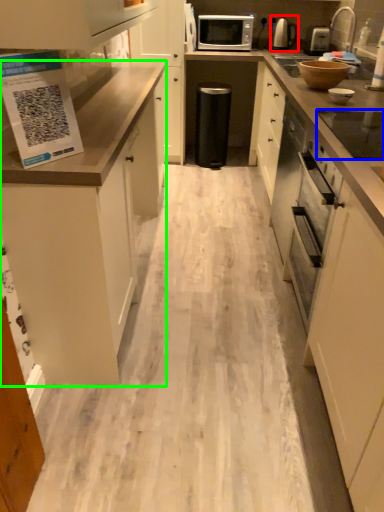
Question: Which object is positioned farthest from kitchen appliance (highlighted by a red box)? Select from appliance (highlighted by a blue box) and cabinetry (highlighted by a green box).

Choices:
 (A) appliance
 (B) cabinetry

Answer: (A)